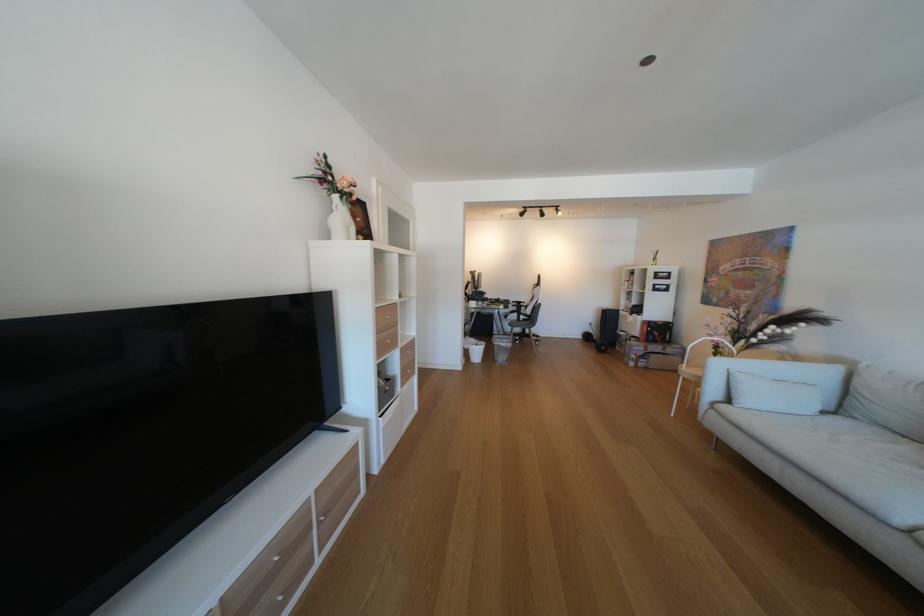
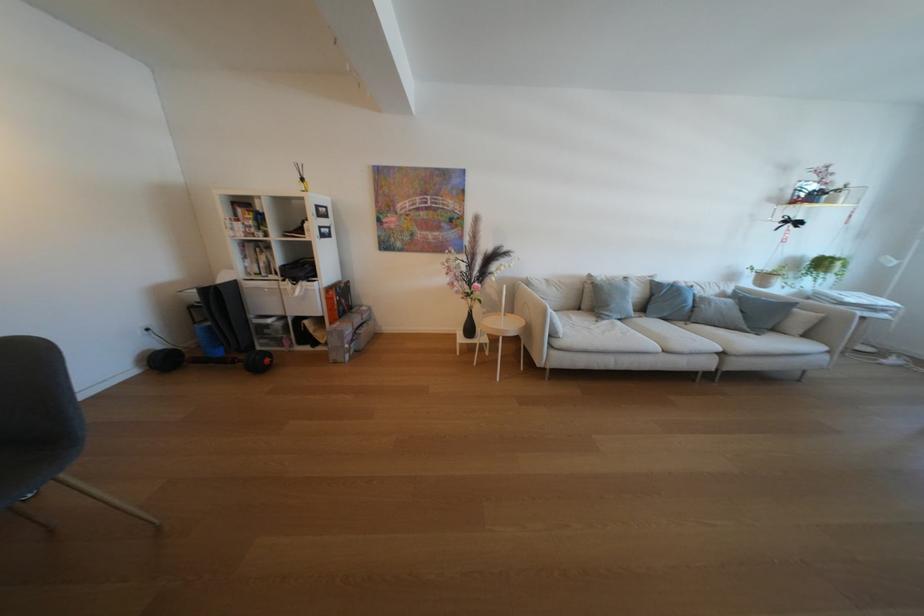
Where in the second image is the point corresponding to point 734,320 from the first image?

(455, 265)